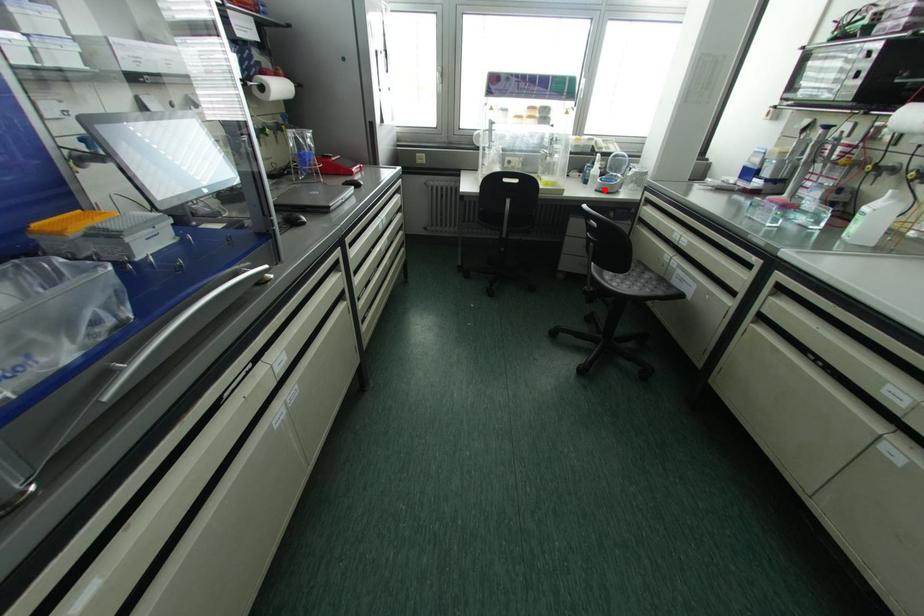
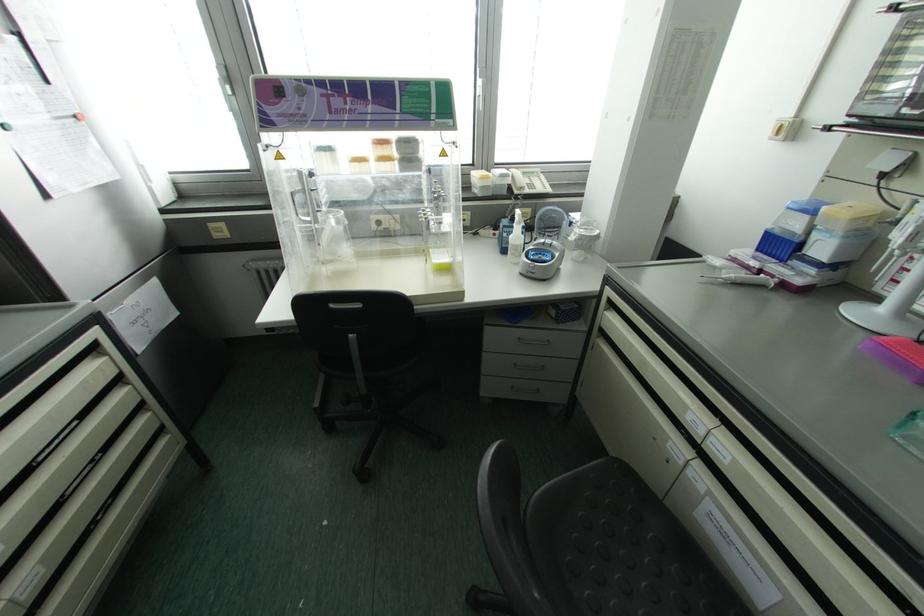
In the second image, find the point that corresponds to the highlighted location in the first image.

(536, 275)